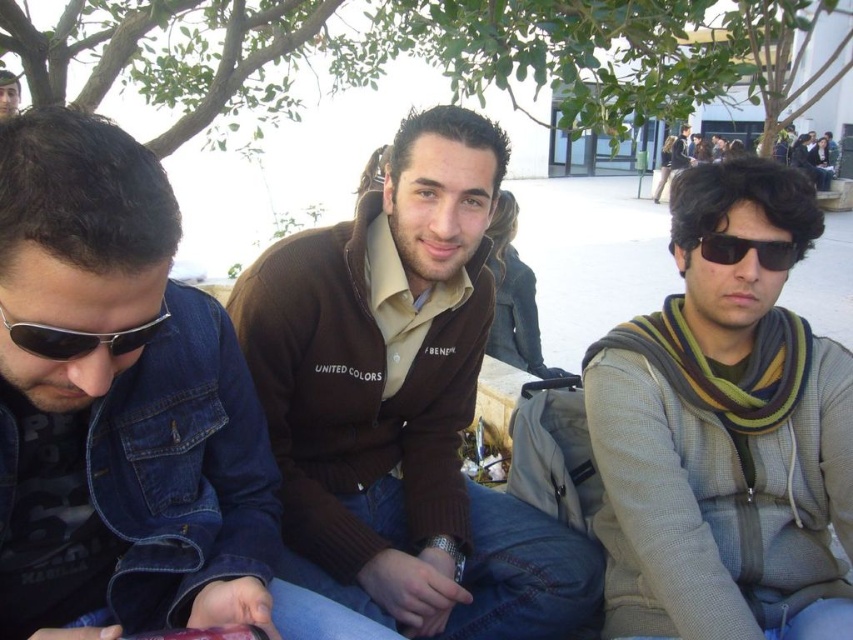
Question: Which point appears farthest from the camera in this image?

Choices:
 (A) click(x=61, y=356)
 (B) click(x=729, y=243)

Answer: (B)

Question: Is striped scarf at right behind sunglasses at left?

Choices:
 (A) no
 (B) yes

Answer: (B)

Question: Is brushed denim jacket at lower left below black plastic sunglasses at right?

Choices:
 (A) yes
 (B) no

Answer: (A)

Question: Which is nearer to the black plastic sunglasses at right?

Choices:
 (A) sunglasses at left
 (B) brushed denim jacket at lower left
 (C) brown sweater at center

Answer: (C)

Question: Which object is farther from the camera taking this photo?

Choices:
 (A) brushed denim jacket at lower left
 (B) striped scarf at right
 (C) brown sweater at center

Answer: (C)

Question: Does striped scarf at right have a greater width compared to black plastic sunglasses at right?

Choices:
 (A) yes
 (B) no

Answer: (A)